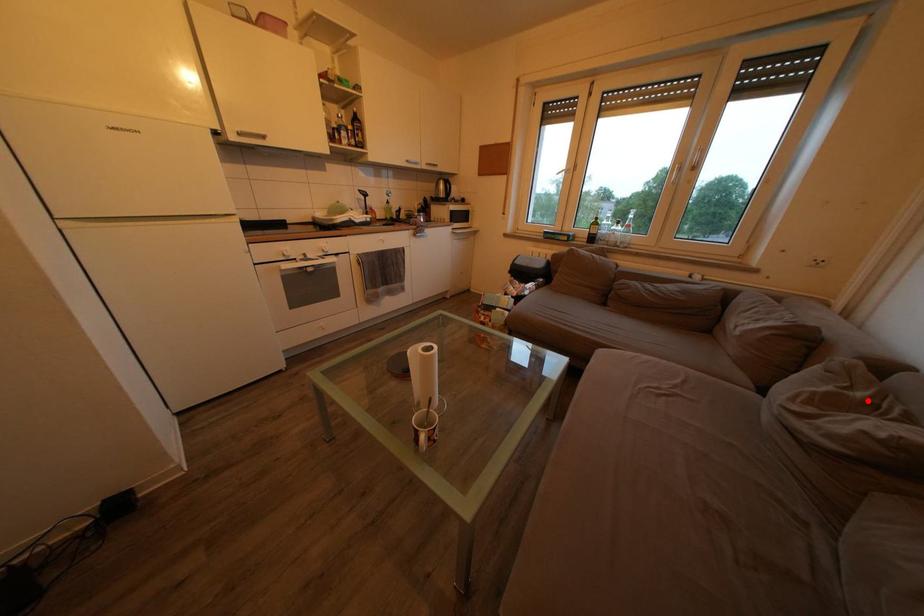
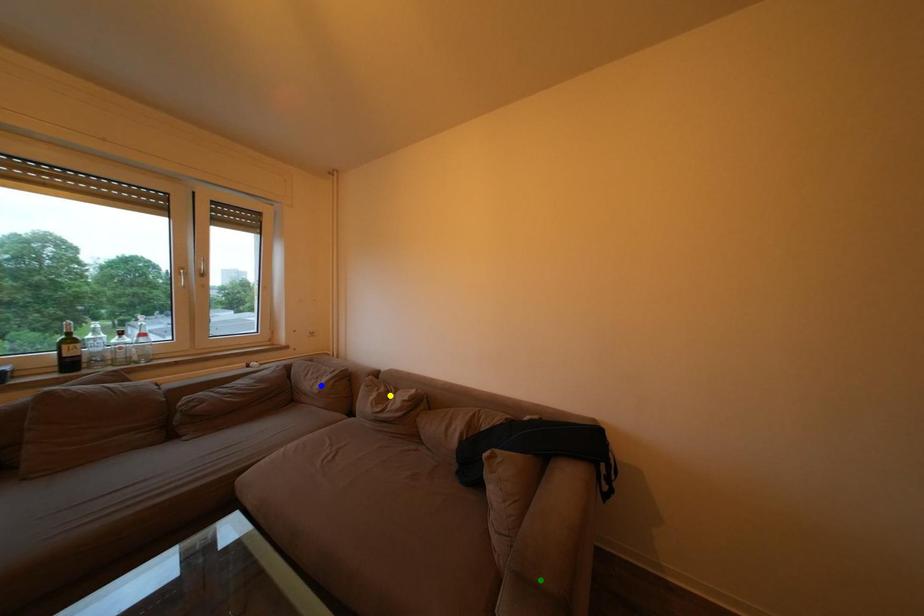
Question: I am providing you with two images of the same scene from different viewpoints. A red point is marked on the first image. You are given multiple points on the second image. Which point in image 2 represents the same 3d spot as the red point in image 1?

Choices:
 (A) yellow point
 (B) green point
 (C) blue point

Answer: (A)